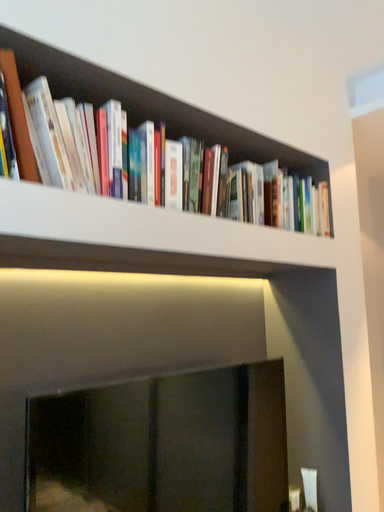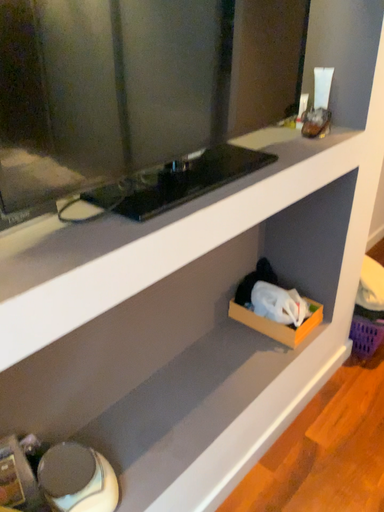
Question: How did the camera likely rotate when shooting the video?

Choices:
 (A) rotated downward
 (B) rotated upward

Answer: (A)